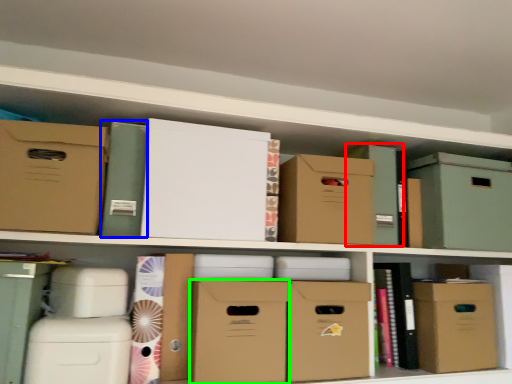
Question: Which object is positioned farthest from box (highlighted by a red box)? Select from book (highlighted by a blue box) and cardboard box (highlighted by a green box).

Choices:
 (A) book
 (B) cardboard box

Answer: (A)